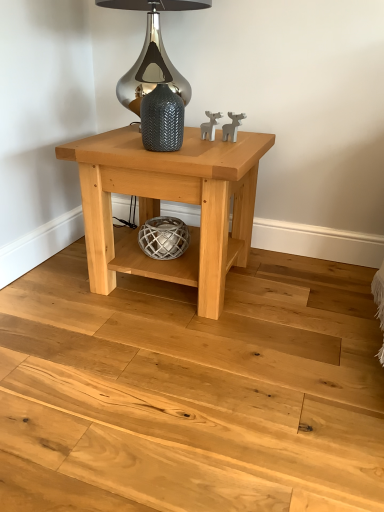
This screenshot has width=384, height=512. What are the coordinates of `free location in front of satin silver glass at upper center` in the screenshot? It's located at (161, 155).